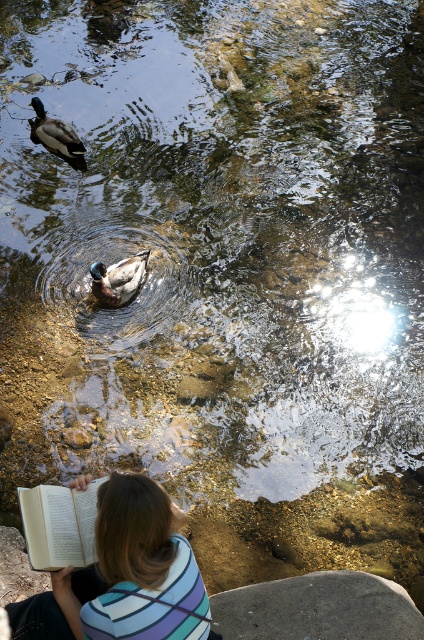
Question: Considering the relative positions of striped fabric shirt at lower center and green glossy duck at upper left in the image provided, where is striped fabric shirt at lower center located with respect to green glossy duck at upper left?

Choices:
 (A) right
 (B) left

Answer: (A)

Question: Which point is closer to the camera?

Choices:
 (A) (25, 493)
 (B) (119, 278)
 (C) (122, 493)

Answer: (C)

Question: Which point appears closest to the camera in this image?

Choices:
 (A) (10, 620)
 (B) (49, 538)
 (C) (52, 145)

Answer: (B)

Question: Which object is farther from the camera taking this photo?

Choices:
 (A) white paper book at lower left
 (B) striped fabric shirt at lower center

Answer: (A)

Question: Observing the image, what is the correct spatial positioning of striped fabric shirt at lower center in reference to green glossy duck at upper left?

Choices:
 (A) below
 (B) above

Answer: (A)

Question: Can you confirm if striped fabric shirt at lower center is smaller than white paper book at lower left?

Choices:
 (A) no
 (B) yes

Answer: (A)